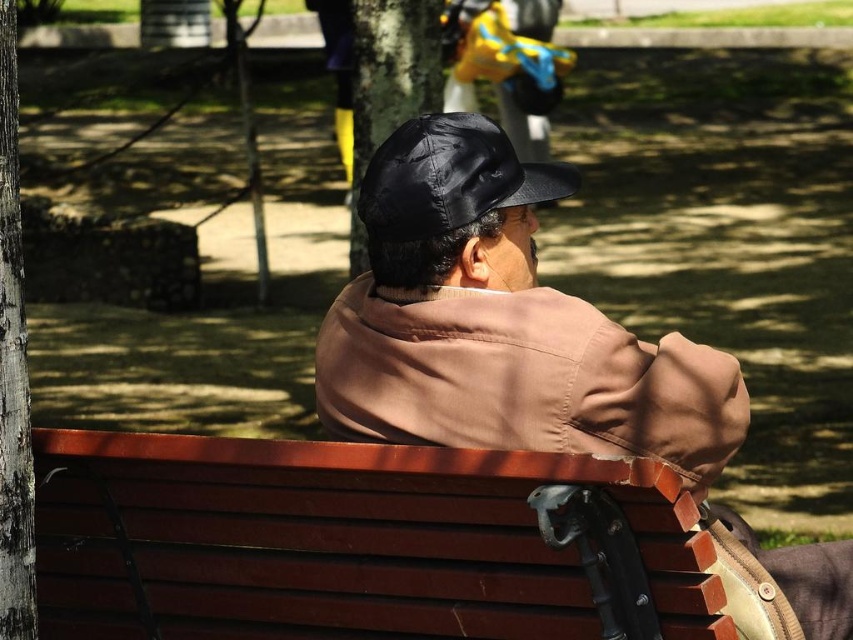
From the picture: Can you confirm if wooden bench at center is shorter than brown matte jacket at center?

Yes, wooden bench at center is shorter than brown matte jacket at center.

Where is `wooden bench at center`? The image size is (853, 640). wooden bench at center is located at coordinates (357, 541).

Is the position of gray textured bark at left less distant than that of black matte tree at upper center?

Yes, gray textured bark at left is in front of black matte tree at upper center.

In order to click on gray textured bark at left in this screenshot , I will do `click(13, 368)`.

At what (x,y) coordinates should I click in order to perform the action: click on gray textured bark at left. Please return your answer as a coordinate pair (x, y). Looking at the image, I should click on (13, 368).

Is wooden bench at center smaller than black leather cap at center?

No.

Is point (57, 488) closer to camera compared to point (566, 196)?

Yes, point (57, 488) is in front of point (566, 196).

Describe the element at coordinates (357, 541) in the screenshot. I see `wooden bench at center` at that location.

In order to click on wooden bench at center in this screenshot , I will do `click(357, 541)`.